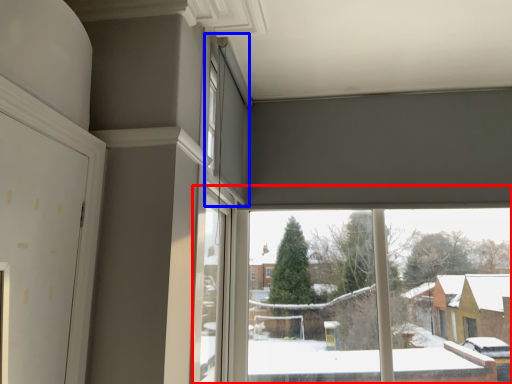
Question: Which object is closer to the camera taking this photo, window (highlighted by a red box) or window (highlighted by a blue box)?

Choices:
 (A) window
 (B) window

Answer: (B)